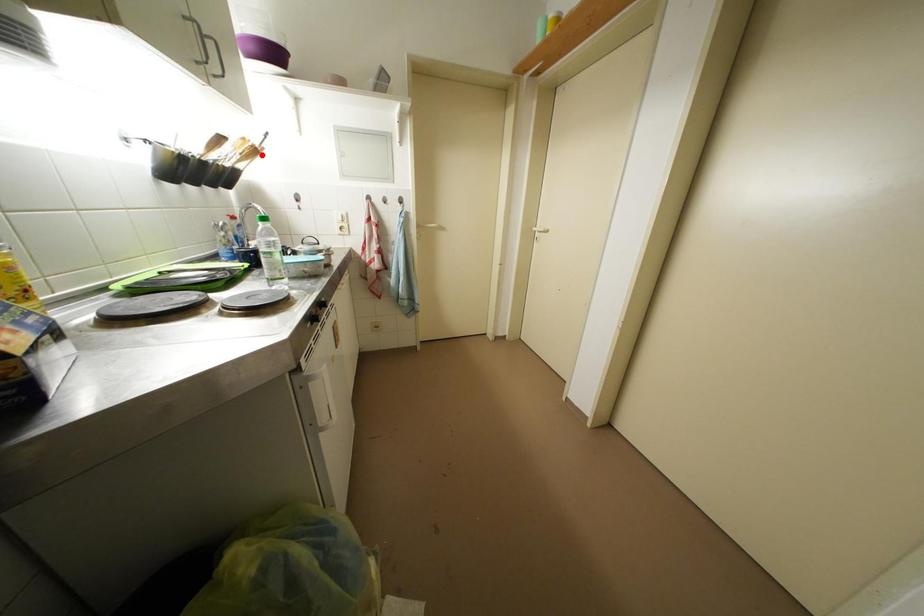
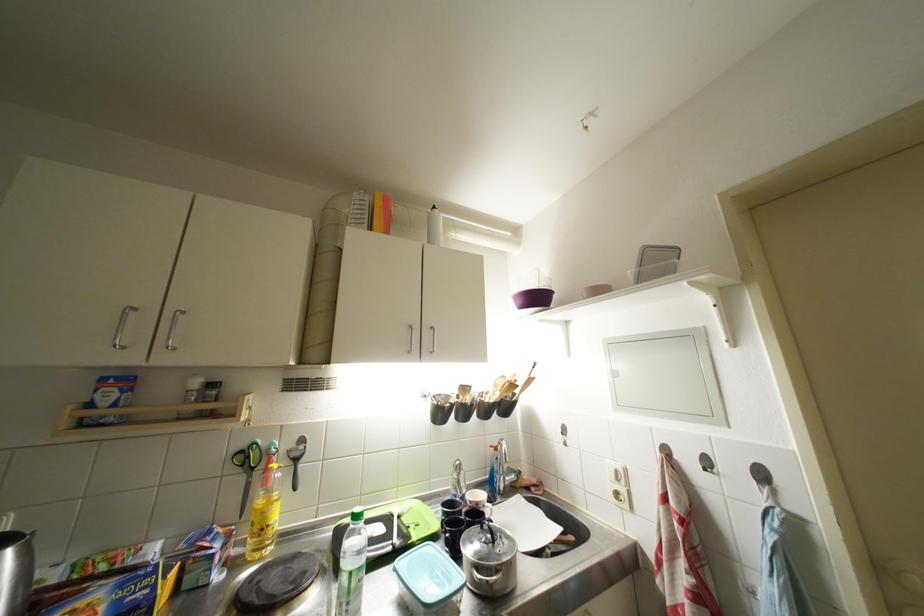
Where in the second image is the point corresponding to the highlighted location from the first image?

(519, 390)